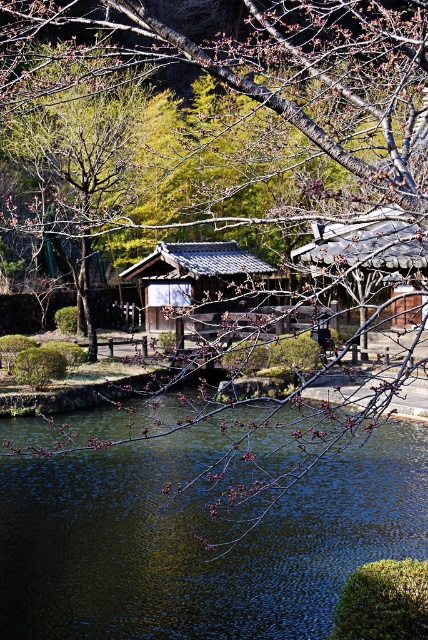
You are standing in a traditional Japanese garden and want to take a photo of both the shiny dark water at center and the matte gray wooden hut at center. Which object will appear smaller in your photo?

The shiny dark water at center will appear smaller in the photo because it is not as tall as the matte gray wooden hut at center.

You are planning to take a photo of the shiny dark water at center and the matte gray wooden hut at center. Which object will appear smaller in your photo?

The shiny dark water at center will appear smaller in the photo because it occupies less space than the matte gray wooden hut at center.